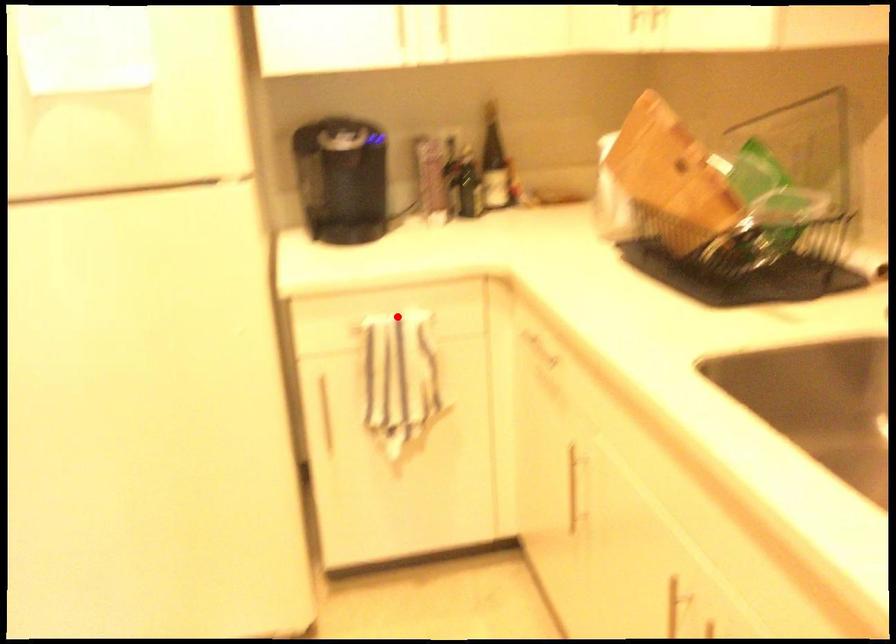
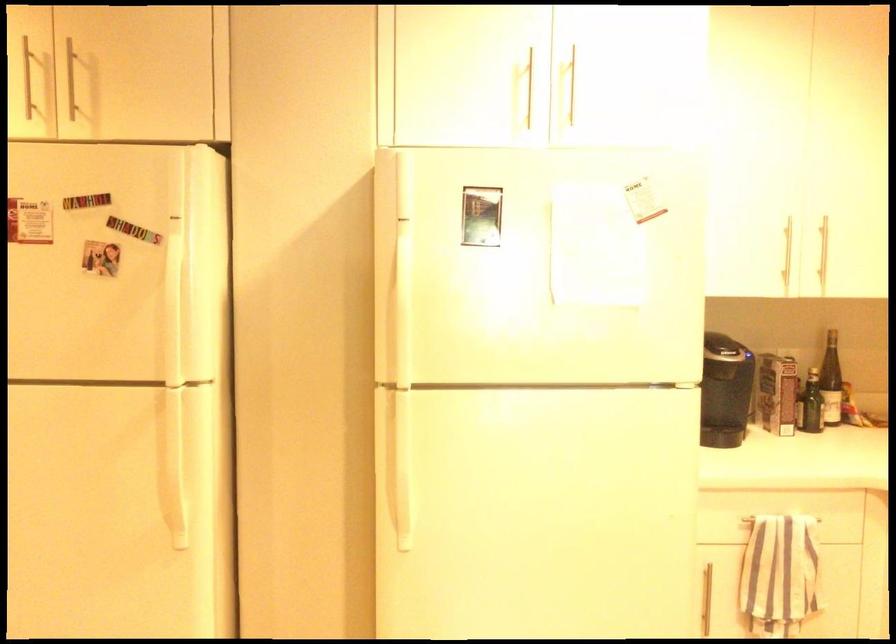
Question: I am providing you with two images of the same scene from different viewpoints. Image1 has a red point marked. In image2, the corresponding 3D location appears at what relative position? Reply with the corresponding letter.

Choices:
 (A) Closer
 (B) Farther

Answer: (B)